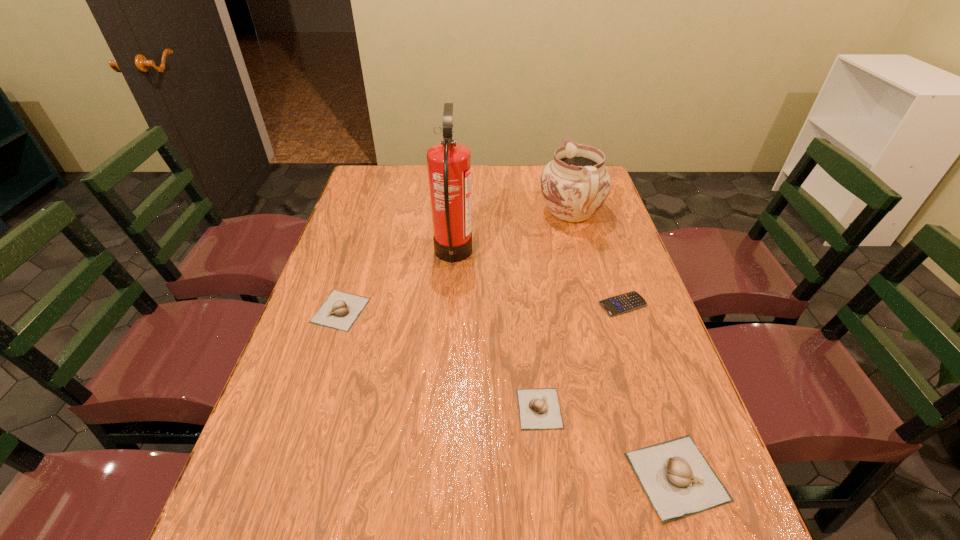
Identify the location of object positioned at the left edge. (340, 310).

You are a GUI agent. You are given a task and a screenshot of the screen. Output one action in this format:
    pyautogui.click(x=<x>, y=<y>)
    Task: Click on the garlic positioned at the right edge
    
    Given the screenshot: What is the action you would take?
    pyautogui.click(x=678, y=480)

At what (x,y) coordinates should I click in order to perform the action: click on calculator located in the right edge section of the desktop. Please return your answer as a coordinate pair (x, y). This screenshot has width=960, height=540. Looking at the image, I should click on (626, 302).

I want to click on pitcher positioned at the right edge, so click(575, 184).

Image resolution: width=960 pixels, height=540 pixels. Find the location of `object positioned at the far right corner`. object positioned at the far right corner is located at coordinates (575, 184).

At what (x,y) coordinates should I click in order to perform the action: click on object at the near right corner. Please return your answer as a coordinate pair (x, y). The width and height of the screenshot is (960, 540). Looking at the image, I should click on (678, 480).

Find the location of `blank space at the far edge of the desktop`. blank space at the far edge of the desktop is located at coordinates (478, 197).

Where is `free space at the near edge of the desktop`? This screenshot has width=960, height=540. free space at the near edge of the desktop is located at coordinates (362, 477).

Find the location of `free location at the left edge`. free location at the left edge is located at coordinates (344, 280).

Identify the location of vacant space at the right edge. Image resolution: width=960 pixels, height=540 pixels. (580, 235).